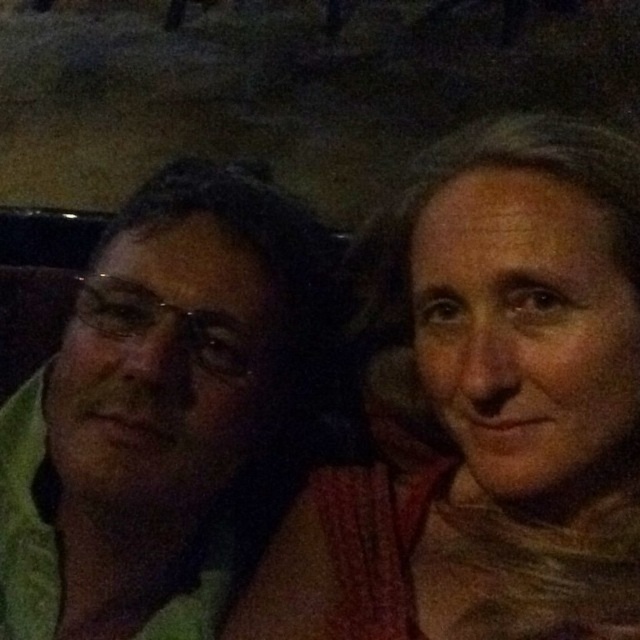
Question: Is smooth beige scarf at right further to the viewer compared to green fabric at left?

Choices:
 (A) yes
 (B) no

Answer: (B)

Question: Which object is farther from the camera taking this photo?

Choices:
 (A) green fabric at left
 (B) smooth beige scarf at right

Answer: (A)

Question: Does smooth beige scarf at right have a greater width compared to green fabric at left?

Choices:
 (A) no
 (B) yes

Answer: (B)

Question: Is smooth beige scarf at right further to the viewer compared to green fabric at left?

Choices:
 (A) yes
 (B) no

Answer: (B)

Question: Which point is closer to the camera?

Choices:
 (A) (221, 540)
 (B) (570, 128)

Answer: (B)